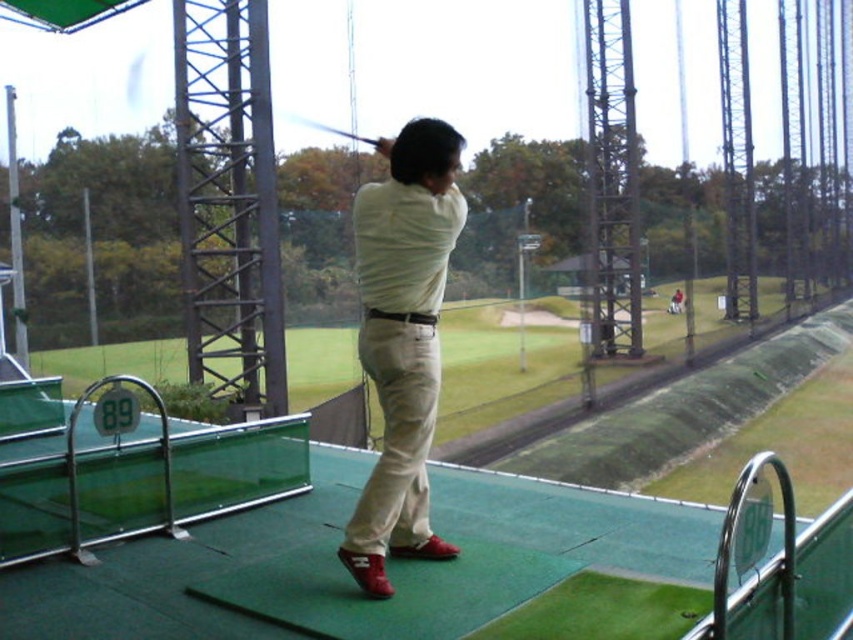
How far apart are matte white shirt at center and shiny black golf club at center?

matte white shirt at center and shiny black golf club at center are 70.15 feet apart.

Does matte white shirt at center come behind shiny black golf club at center?

No, it is in front of shiny black golf club at center.

In the scene shown: Who is more distant from viewer, [412,195] or [358,136]?

The point [358,136] is behind.

Find the location of a particular element. The height and width of the screenshot is (640, 853). matte white shirt at center is located at coordinates (402, 340).

Can you confirm if green rubber mat at center is wider than matte white shirt at center?

Result: Correct, the width of green rubber mat at center exceeds that of matte white shirt at center.

Can you confirm if green rubber mat at center is smaller than matte white shirt at center?

Actually, green rubber mat at center might be larger than matte white shirt at center.

Is point (207, 630) positioned after point (418, 538)?

No, it is not.

The image size is (853, 640). I want to click on green rubber mat at center, so click(x=344, y=570).

Which is more to the left, green rubber mat at center or shiny black golf club at center?

shiny black golf club at center

At what (x,y) coordinates should I click in order to perform the action: click on green rubber mat at center. Please return your answer as a coordinate pair (x, y). Looking at the image, I should click on (344, 570).